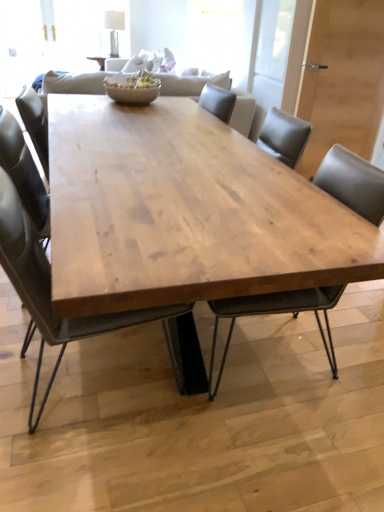
Question: Which direction should I rotate to look at matte wood chair at center, which appears as the 2th chair when viewed from the left?

Choices:
 (A) left
 (B) right

Answer: (B)

Question: Can matte black chair at center, the first chair when ordered from left to right, be found inside natural wood table at center?

Choices:
 (A) yes
 (B) no

Answer: (A)

Question: Is matte black chair at center, the second chair when ordered from right to left, at the back of natural wood table at center?

Choices:
 (A) no
 (B) yes

Answer: (B)

Question: Considering the relative sizes of natural wood table at center and matte black chair at center, the first chair when ordered from left to right, in the image provided, is natural wood table at center thinner than matte black chair at center, the first chair when ordered from left to right,?

Choices:
 (A) yes
 (B) no

Answer: (B)

Question: Does natural wood table at center appear on the right side of matte black chair at center, the second chair when ordered from right to left?

Choices:
 (A) no
 (B) yes

Answer: (B)

Question: Considering the relative positions of natural wood table at center and matte black chair at center, the first chair when ordered from left to right, in the image provided, is natural wood table at center to the left of matte black chair at center, the first chair when ordered from left to right, from the viewer's perspective?

Choices:
 (A) no
 (B) yes

Answer: (A)

Question: Is natural wood table at center positioned far away from matte black chair at center, the first chair when ordered from left to right?

Choices:
 (A) yes
 (B) no

Answer: (B)

Question: Is matte wood chair at center, which appears as the 2th chair when viewed from the left, placed right next to natural wood table at center?

Choices:
 (A) no
 (B) yes

Answer: (A)

Question: Is matte wood chair at center, which appears as the 2th chair when viewed from the left, shorter than natural wood table at center?

Choices:
 (A) yes
 (B) no

Answer: (B)

Question: From the image's perspective, is matte wood chair at center, which appears as the 2th chair when viewed from the left, located above natural wood table at center?

Choices:
 (A) yes
 (B) no

Answer: (B)

Question: From the image's perspective, does matte wood chair at center, the 1th chair viewed from the right, appear lower than natural wood table at center?

Choices:
 (A) no
 (B) yes

Answer: (B)

Question: Is matte wood chair at center, which appears as the 2th chair when viewed from the left, at the left side of natural wood table at center?

Choices:
 (A) no
 (B) yes

Answer: (A)

Question: Is matte wood chair at center, the 1th chair viewed from the right, bigger than natural wood table at center?

Choices:
 (A) yes
 (B) no

Answer: (B)

Question: Is matte brown bowl at center at the left side of matte wood chair at center, which appears as the 2th chair when viewed from the left?

Choices:
 (A) yes
 (B) no

Answer: (A)